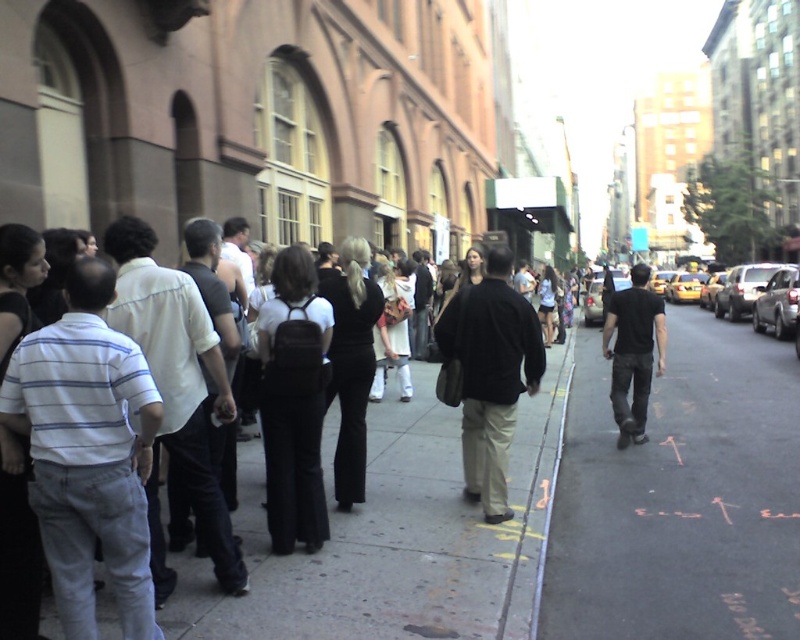
Question: Is black matte backpack at center thinner than metallic silver sedan at center-right?

Choices:
 (A) no
 (B) yes

Answer: (B)

Question: Does black asphalt at center appear under white striped shirt at left?

Choices:
 (A) yes
 (B) no

Answer: (A)

Question: Does black matte pants at center appear under metallic silver sedan at center-right?

Choices:
 (A) no
 (B) yes

Answer: (B)

Question: Estimate the real-world distances between objects in this image. Which object is closer to the white striped shirt at left?

Choices:
 (A) yellow matte taxi cab at center-right
 (B) concrete curb at center
 (C) dark brown leather jacket at center
 (D) black matte shirt at center

Answer: (B)

Question: Which point is closer to the camera taking this photo?

Choices:
 (A) (277, 518)
 (B) (508, 557)
 (C) (392, 392)

Answer: (A)

Question: Which point is farther to the camera?

Choices:
 (A) (537, 486)
 (B) (768, 291)
 (C) (750, 300)
 (D) (262, 580)

Answer: (C)